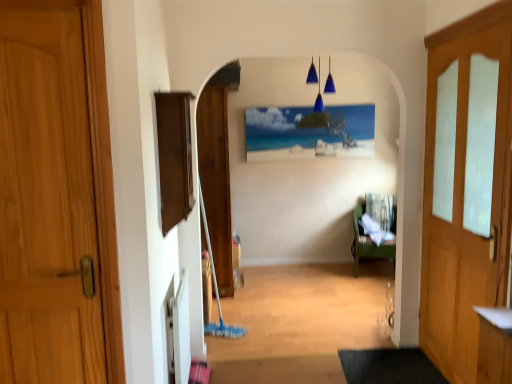
Find the location of a particular element. Image resolution: width=512 pixels, height=384 pixels. empty space that is ontop of wooden door at right, which is counted as the first door, starting from the right (from a real-world perspective) is located at coordinates (471, 15).